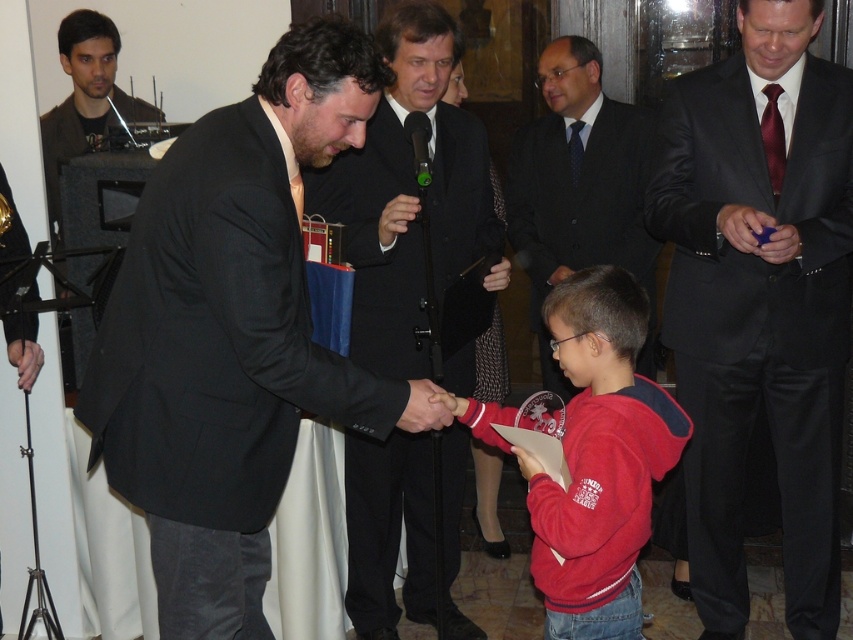
Which of these two, black matte suit at center or black leather hand at center, stands taller?

With more height is black matte suit at center.

Between black matte suit at center and black leather hand at center, which one has less height?

Standing shorter between the two is black leather hand at center.

What do you see at coordinates (230, 332) in the screenshot? The height and width of the screenshot is (640, 853). I see `black matte suit at center` at bounding box center [230, 332].

Locate an element on the screen. black matte suit at center is located at coordinates (230, 332).

Which is more to the right, black matte suit at center or black suit at center?

black suit at center is more to the right.

Is point (267, 369) farther from viewer compared to point (366, 616)?

That is False.

This screenshot has height=640, width=853. I want to click on black matte suit at center, so (230, 332).

Does red fleece jacket at lower center have a greater width compared to dark suit at center?

Yes.

Which is in front, point (643, 419) or point (643, 369)?

Positioned in front is point (643, 419).

What are the coordinates of `red fleece jacket at lower center` in the screenshot? It's located at (595, 458).